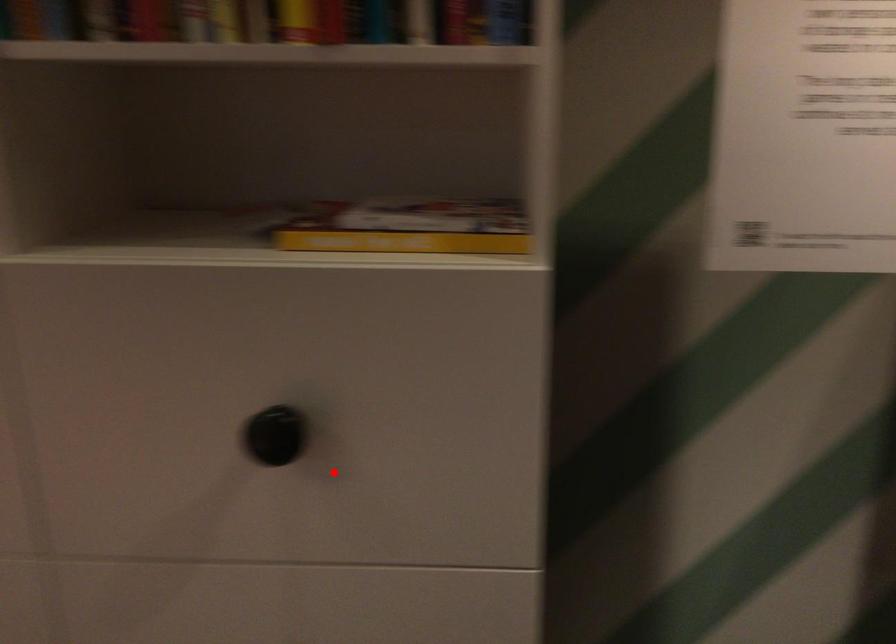
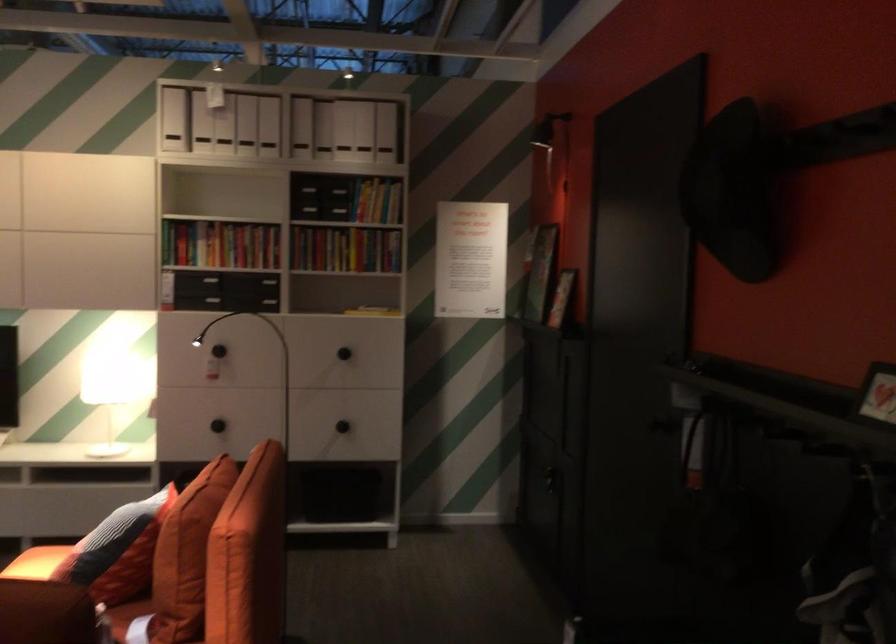
Find the pixel in the second image that matches the highlighted location in the first image.

(343, 353)